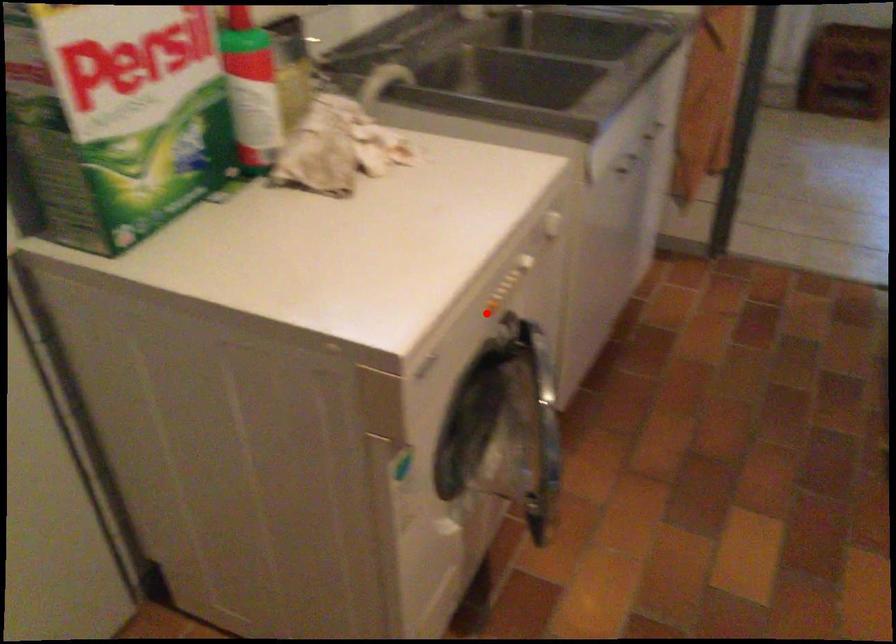
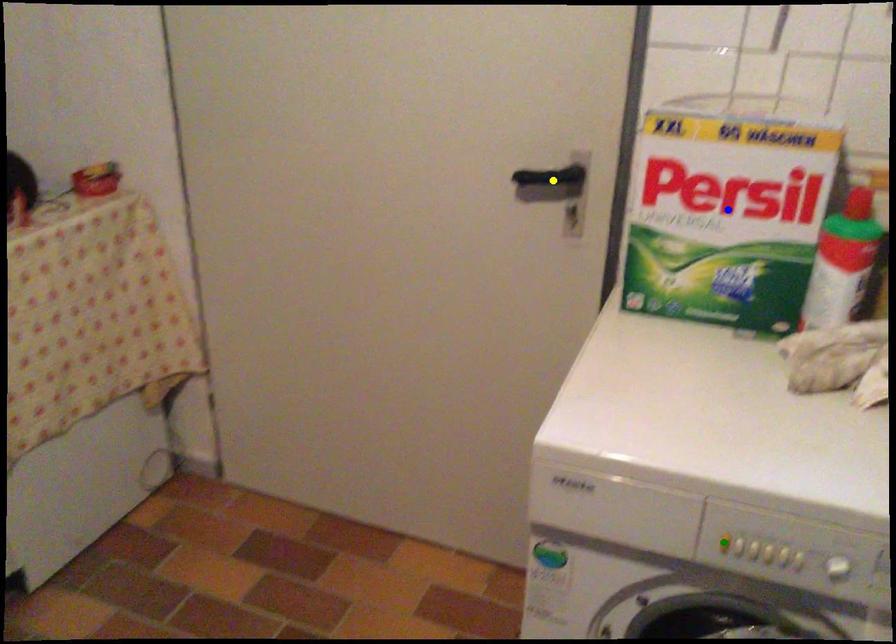
Question: I am providing you with two images of the same scene from different viewpoints. A red point is marked on the first image. You are given multiple points on the second image. Which spot in image 2 lines up with the point in image 1?

Choices:
 (A) green point
 (B) yellow point
 (C) blue point

Answer: (A)